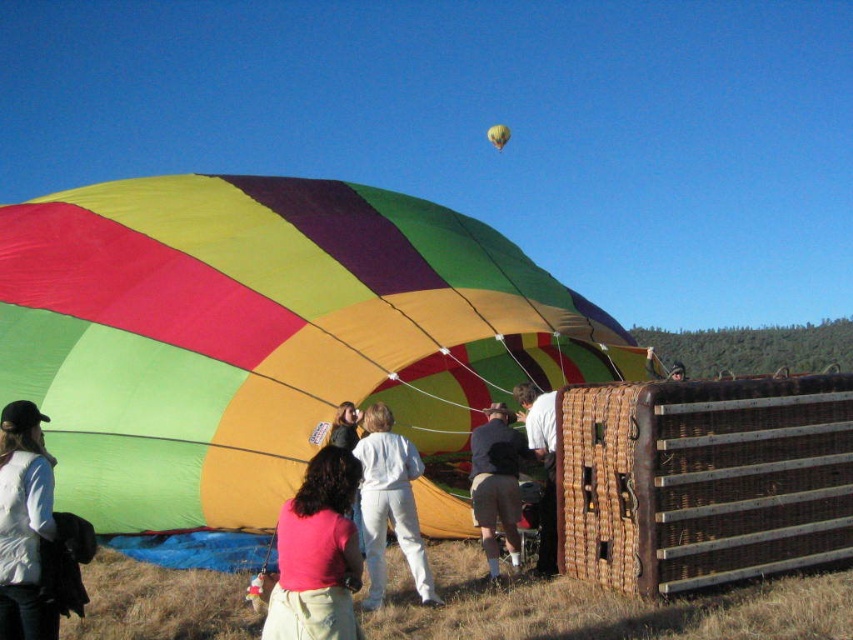
You are a participant in the hot air balloon event and need to determine which object is shorter between the dark blue fabric at center and the white wicker basket at center. Can you identify the shorter one?

The dark blue fabric at center is not as tall as the white wicker basket at center, so the dark blue fabric at center is shorter.

You are standing at the center of the image and see the point marked at coordinates (389, 504). What object is located at that point?

The object at point (389, 504) is white cotton pants at center.